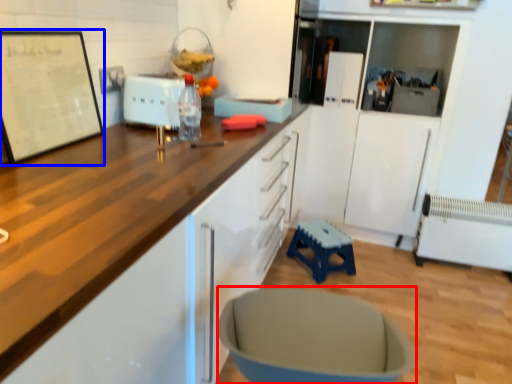
Question: Which of the following is the farthest to the observer, swivel chair (highlighted by a red box) or bulletin board (highlighted by a blue box)?

Choices:
 (A) swivel chair
 (B) bulletin board

Answer: (B)